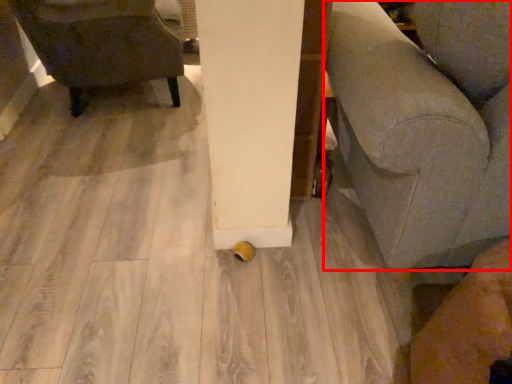
Question: In this image, where is furniture (annotated by the red box) located relative to chair?

Choices:
 (A) left
 (B) right

Answer: (B)